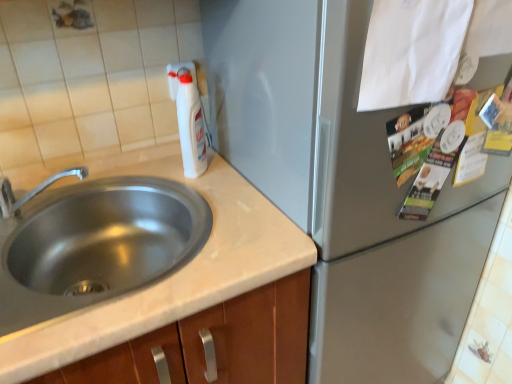
Question: From the image's perspective, relative to stainless steel sink at left, is satin silver refrigerator at center above or below?

Choices:
 (A) below
 (B) above

Answer: (B)

Question: Considering the positions of satin silver refrigerator at center and stainless steel sink at left in the image, is satin silver refrigerator at center taller or shorter than stainless steel sink at left?

Choices:
 (A) tall
 (B) short

Answer: (A)

Question: Estimate the real-world distances between objects in this image. Which object is closer to the brushed metal faucet at left?

Choices:
 (A) stainless steel sink at left
 (B) white plastic bottle at upper center
 (C) white paper at upper right
 (D) satin silver refrigerator at center

Answer: (A)

Question: Which object is positioned farthest from the white paper at upper right?

Choices:
 (A) satin silver refrigerator at center
 (B) white plastic bottle at upper center
 (C) stainless steel sink at left
 (D) brushed metal faucet at left

Answer: (D)